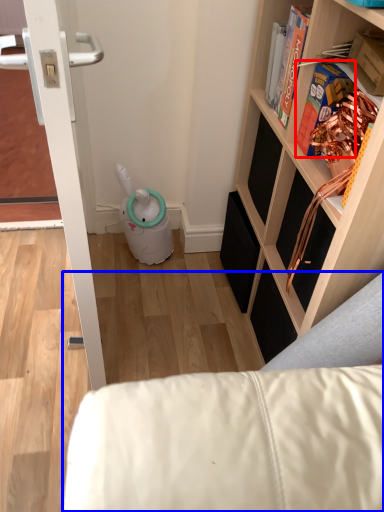
Question: Which object appears farthest to the camera in this image, book (highlighted by a red box) or furniture (highlighted by a blue box)?

Choices:
 (A) book
 (B) furniture

Answer: (B)